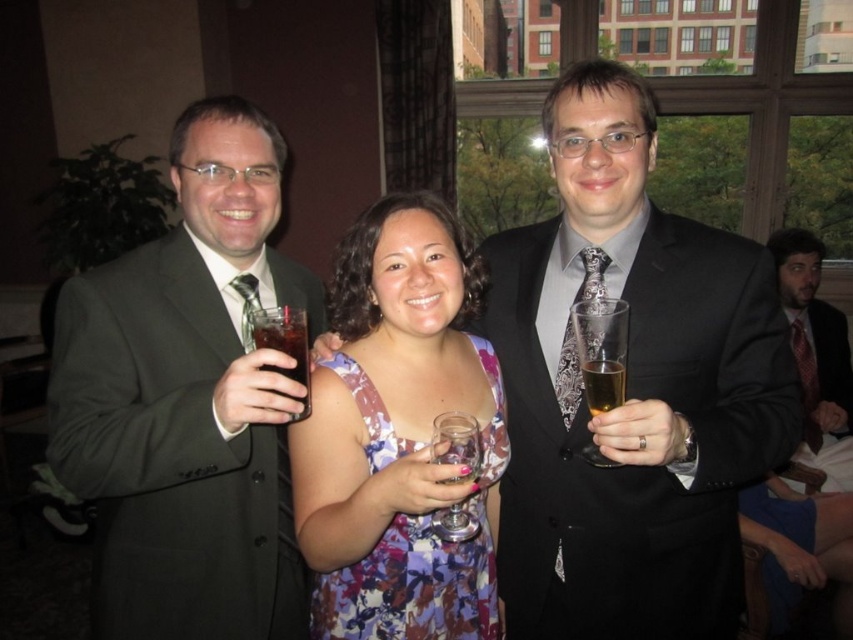
You are at a party and want to know if the matte black suit at left can completely cover the clear glass at right if placed over it. Based on their sizes, what do you think?

The matte black suit at left is larger in size than the clear glass at right, so it can completely cover the clear glass at right.

You are a photographer at the event and need to ensure all items are visible in the photo. Given that the matte black suit at left and the translucent glass beer at right are in the frame, which one would appear larger in the final photo?

The matte black suit at left would appear larger in the final photo because it is bigger than the translucent glass beer at right.

You are a photographer adjusting your camera settings to focus on the clear glass wine glass at center. Considering the matte black suit at right is closer to you, will the glass still be in focus if you focus on the suit?

The matte black suit at right is further to the viewer than clear glass wine glass at center. Wait, but the description says the opposite. Let me check again. The Objects Description states that the matte black suit at right is further to the viewer than the clear glass wine glass at center. Hmm, that means the suit is farther away from the viewer compared to the glass. So if you focus on the suit, which is farther, the clear glass wine glass at center, being closer, might be out of focus. But in depth of f